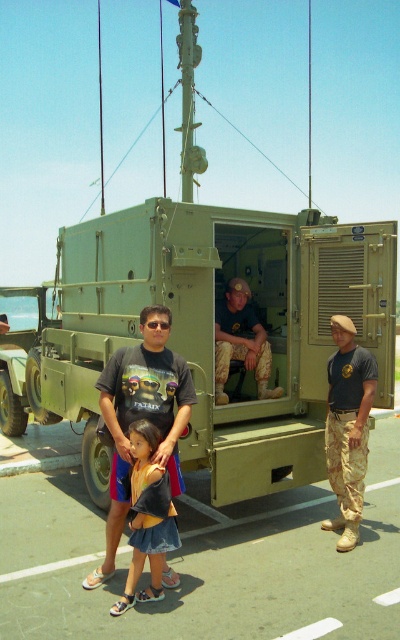
Between dark gray t-shirt at center and matte green military truck at left, which one appears on the left side from the viewer's perspective?

Positioned to the left is matte green military truck at left.

Who is taller, dark gray t-shirt at center or matte green military truck at left?

Standing taller between the two is matte green military truck at left.

The image size is (400, 640). Identify the location of dark gray t-shirt at center. (142, 417).

What do you see at coordinates (23, 365) in the screenshot?
I see `matte green military truck at left` at bounding box center [23, 365].

Is matte green military truck at left wider than camouflage fabric pants at center?

Correct, the width of matte green military truck at left exceeds that of camouflage fabric pants at center.

Is point (24, 364) closer to viewer compared to point (266, 346)?

No, it is behind (266, 346).

The height and width of the screenshot is (640, 400). I want to click on matte green military truck at left, so click(x=23, y=365).

Can you confirm if camouflage pants at right is taller than matte green military truck at left?

No.

Is camouflage pants at right thinner than matte green military truck at left?

Indeed, camouflage pants at right has a lesser width compared to matte green military truck at left.

You are a GUI agent. You are given a task and a screenshot of the screen. Output one action in this format:
    pyautogui.click(x=<x>, y=<y>)
    Task: Click on the camouflage pants at right
    
    Given the screenshot: What is the action you would take?
    pyautogui.click(x=348, y=428)